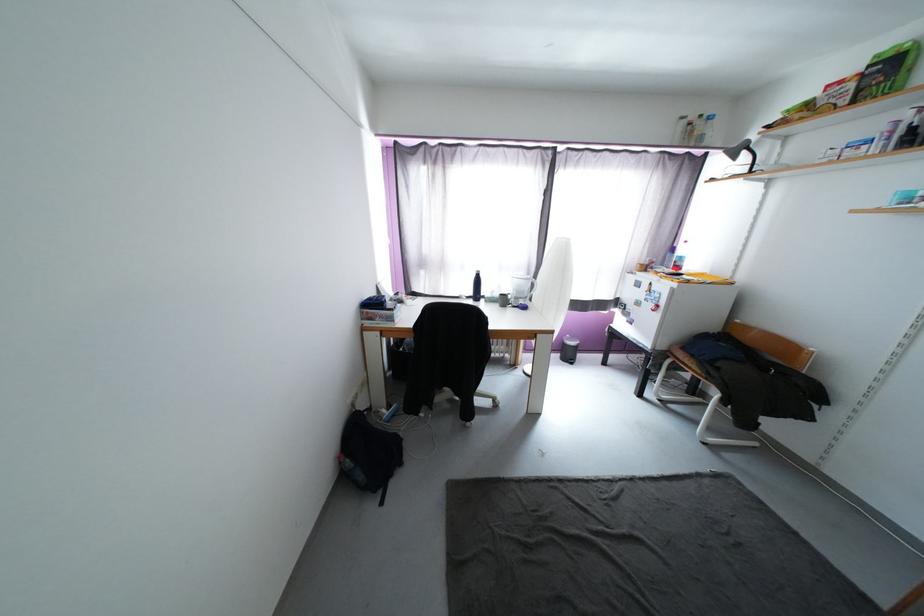
Find where to lift the white electric kettle. Please return your answer as a coordinate pair (x, y).

(521, 289)